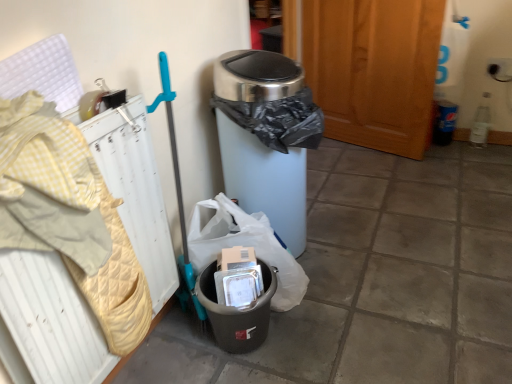
Where is `wooden screen door at center`? The height and width of the screenshot is (384, 512). wooden screen door at center is located at coordinates (374, 69).

What do you see at coordinates (48, 323) in the screenshot? I see `yellow quilted radiator at left` at bounding box center [48, 323].

Where is `wooden screen door at center`? This screenshot has width=512, height=384. wooden screen door at center is located at coordinates (374, 69).

In terms of height, does matte gray trash can at lower left, which is counted as the second waste container, starting from the top, look taller or shorter compared to black plastic trash can at lower center?

In the image, matte gray trash can at lower left, which is counted as the second waste container, starting from the top, appears to be shorter than black plastic trash can at lower center.

Could you tell me if matte gray trash can at lower left, arranged as the first waste container when ordered from the bottom, is turned towards black plastic trash can at lower center?

No, matte gray trash can at lower left, arranged as the first waste container when ordered from the bottom, is not turned towards black plastic trash can at lower center.

From the image's perspective, is matte gray trash can at lower left, arranged as the first waste container when ordered from the bottom, beneath black plastic trash can at lower center?

Yes, from the image's perspective, matte gray trash can at lower left, arranged as the first waste container when ordered from the bottom, is below black plastic trash can at lower center.

Does stainless steel trash can at center, the first waste container in the top-to-bottom sequence, appear on the right side of wooden screen door at center?

No.

Considering the relative sizes of stainless steel trash can at center, the first waste container in the top-to-bottom sequence, and wooden screen door at center in the image provided, is stainless steel trash can at center, the first waste container in the top-to-bottom sequence, wider than wooden screen door at center?

Yes, stainless steel trash can at center, the first waste container in the top-to-bottom sequence, is wider than wooden screen door at center.

Between stainless steel trash can at center, which is counted as the 2th waste container, starting from the bottom, and wooden screen door at center, which one is positioned behind?

wooden screen door at center.

In the scene shown: From a real-world perspective, is stainless steel trash can at center, which is counted as the 2th waste container, starting from the bottom, positioned over wooden screen door at center based on gravity?

No, from a real-world perspective, stainless steel trash can at center, which is counted as the 2th waste container, starting from the bottom, is not over wooden screen door at center

Is matte gray trash can at lower left, arranged as the first waste container when ordered from the bottom, far away from wooden screen door at center?

Yes, matte gray trash can at lower left, arranged as the first waste container when ordered from the bottom, is far from wooden screen door at center.

Could you measure the distance between matte gray trash can at lower left, which is counted as the second waste container, starting from the top, and wooden screen door at center?

matte gray trash can at lower left, which is counted as the second waste container, starting from the top, and wooden screen door at center are 4.58 feet apart from each other.

Do you think matte gray trash can at lower left, which is counted as the second waste container, starting from the top, is within wooden screen door at center, or outside of it?

matte gray trash can at lower left, which is counted as the second waste container, starting from the top, is located beyond the bounds of wooden screen door at center.

From the image's perspective, does black plastic trash can at lower center appear higher than yellow quilted radiator at left?

No, from the image's perspective, black plastic trash can at lower center is not above yellow quilted radiator at left.

The image size is (512, 384). I want to click on garbage that is on the right side of yellow quilted radiator at left, so click(244, 245).

Looking at this image, is black plastic trash can at lower center next to yellow quilted radiator at left?

They are not placed beside each other.

Does black plastic trash can at lower center have a larger size compared to yellow quilted radiator at left?

Yes, black plastic trash can at lower center is bigger than yellow quilted radiator at left.

From the image's perspective, is yellow quilted radiator at left located above black plastic trash can at lower center?

Yes.

Can you confirm if yellow quilted radiator at left is shorter than black plastic trash can at lower center?

No.

The height and width of the screenshot is (384, 512). What are the coordinates of `garbage located below the yellow quilted radiator at left (from the image's perspective)` in the screenshot? It's located at (244, 245).

From the image's perspective, relative to wooden screen door at center, is black plastic trash can at lower center above or below?

black plastic trash can at lower center is below wooden screen door at center.

Is black plastic trash can at lower center beside wooden screen door at center?

No, black plastic trash can at lower center is not beside wooden screen door at center.

This screenshot has width=512, height=384. In order to click on screen door behind the black plastic trash can at lower center in this screenshot , I will do `click(374, 69)`.

Which object is thinner, black plastic trash can at lower center or wooden screen door at center?

wooden screen door at center.

Is matte gray trash can at lower left, arranged as the first waste container when ordered from the bottom, located within wooden screen door at center?

No, matte gray trash can at lower left, arranged as the first waste container when ordered from the bottom, is not surrounded by wooden screen door at center.

Is point (379, 112) positioned before point (203, 280)?

No, (379, 112) is behind (203, 280).

Is wooden screen door at center oriented towards matte gray trash can at lower left, which is counted as the second waste container, starting from the top?

Yes, wooden screen door at center is oriented towards matte gray trash can at lower left, which is counted as the second waste container, starting from the top.

From the wooden screen door at center, count 2nd waste containers forward and point to it. Please provide its 2D coordinates.

[(237, 312)]

The height and width of the screenshot is (384, 512). Find the location of `waste container that appears below the black plastic trash can at lower center (from the image's perspective)`. waste container that appears below the black plastic trash can at lower center (from the image's perspective) is located at coordinates (237, 312).

Starting from the wooden screen door at center, which waste container is the 1st one in front? Please provide its 2D coordinates.

[(263, 137)]

Looking at this image, from the image, which object appears to be nearer to wooden screen door at center, stainless steel trash can at center, which is counted as the 2th waste container, starting from the bottom, or black plastic trash can at lower center?

Among the two, stainless steel trash can at center, which is counted as the 2th waste container, starting from the bottom, is located nearer to wooden screen door at center.

Estimate the real-world distances between objects in this image. Which object is closer to black plastic trash can at lower center, matte gray trash can at lower left, which is counted as the second waste container, starting from the top, or stainless steel trash can at center, which is counted as the 2th waste container, starting from the bottom?

The object closer to black plastic trash can at lower center is matte gray trash can at lower left, which is counted as the second waste container, starting from the top.

Which object lies further to the anchor point wooden screen door at center, yellow quilted radiator at left or stainless steel trash can at center, the first waste container in the top-to-bottom sequence?

yellow quilted radiator at left is positioned further to the anchor wooden screen door at center.

Which object lies nearer to the anchor point stainless steel trash can at center, which is counted as the 2th waste container, starting from the bottom, yellow quilted radiator at left or black plastic trash can at lower center?

black plastic trash can at lower center is closer to stainless steel trash can at center, which is counted as the 2th waste container, starting from the bottom.

Looking at the image, which one is located further to yellow quilted radiator at left, matte gray trash can at lower left, which is counted as the second waste container, starting from the top, or black plastic trash can at lower center?

Among the two, black plastic trash can at lower center is located further to yellow quilted radiator at left.

Looking at the image, which one is located closer to yellow quilted radiator at left, wooden screen door at center or stainless steel trash can at center, the first waste container in the top-to-bottom sequence?

The object closer to yellow quilted radiator at left is stainless steel trash can at center, the first waste container in the top-to-bottom sequence.

Based on the photo, when comparing their distances from yellow quilted radiator at left, does black plastic trash can at lower center or wooden screen door at center seem further?

wooden screen door at center is positioned further to the anchor yellow quilted radiator at left.

Based on their spatial positions, is wooden screen door at center or matte gray trash can at lower left, which is counted as the second waste container, starting from the top, closer to yellow quilted radiator at left?

Based on the image, matte gray trash can at lower left, which is counted as the second waste container, starting from the top, appears to be nearer to yellow quilted radiator at left.

This screenshot has height=384, width=512. I want to click on waste container between wooden screen door at center and matte gray trash can at lower left, arranged as the first waste container when ordered from the bottom, from top to bottom, so click(263, 137).

Locate an element on the screen. The height and width of the screenshot is (384, 512). garbage between wooden screen door at center and matte gray trash can at lower left, arranged as the first waste container when ordered from the bottom, in the vertical direction is located at coordinates (244, 245).

Find the location of a particular element. waste container between yellow quilted radiator at left and stainless steel trash can at center, which is counted as the 2th waste container, starting from the bottom, along the z-axis is located at coordinates (237, 312).

This screenshot has width=512, height=384. Find the location of `garbage between stainless steel trash can at center, which is counted as the 2th waste container, starting from the bottom, and wooden screen door at center, along the z-axis`. garbage between stainless steel trash can at center, which is counted as the 2th waste container, starting from the bottom, and wooden screen door at center, along the z-axis is located at coordinates (244, 245).